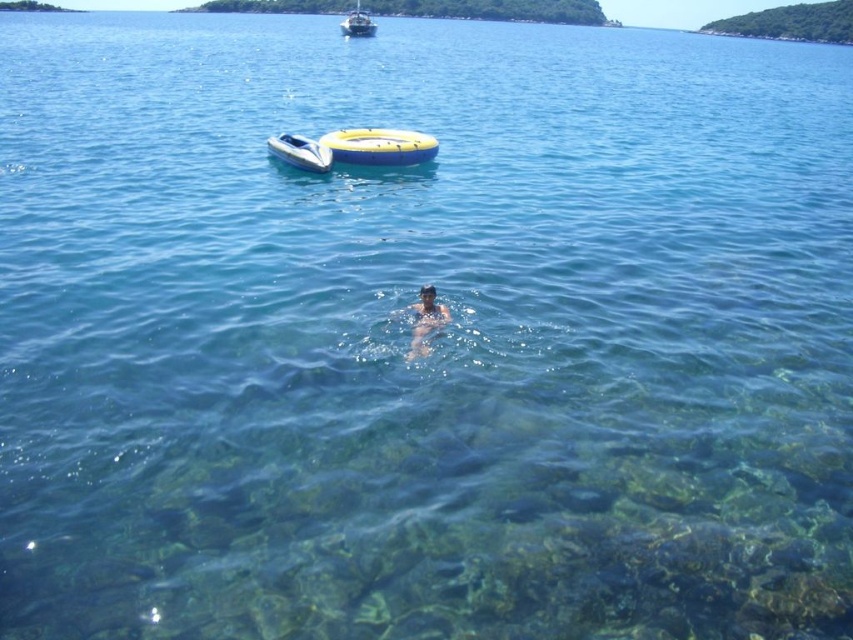
Does white plastic boat at upper center come in front of skinny swimmer at center?

No, white plastic boat at upper center is further to the viewer.

Can you confirm if white plastic boat at upper center is thinner than skinny swimmer at center?

No, white plastic boat at upper center is not thinner than skinny swimmer at center.

Identify the location of white plastic boat at upper center. This screenshot has height=640, width=853. (300, 152).

Which is more to the left, white plastic boat at upper center or white glossy boat at upper center?

white glossy boat at upper center

Looking at this image, who is shorter, white plastic boat at upper center or white glossy boat at upper center?

white plastic boat at upper center is shorter.

The height and width of the screenshot is (640, 853). I want to click on white plastic boat at upper center, so click(x=300, y=152).

Who is taller, skinny swimmer at center or white glossy boat at upper center?

Standing taller between the two is white glossy boat at upper center.

Describe the element at coordinates (426, 320) in the screenshot. The width and height of the screenshot is (853, 640). I see `skinny swimmer at center` at that location.

Who is more forward, (421, 316) or (357, 22)?

Point (421, 316) is more forward.

Find the location of `skinny swimmer at center`. skinny swimmer at center is located at coordinates point(426,320).